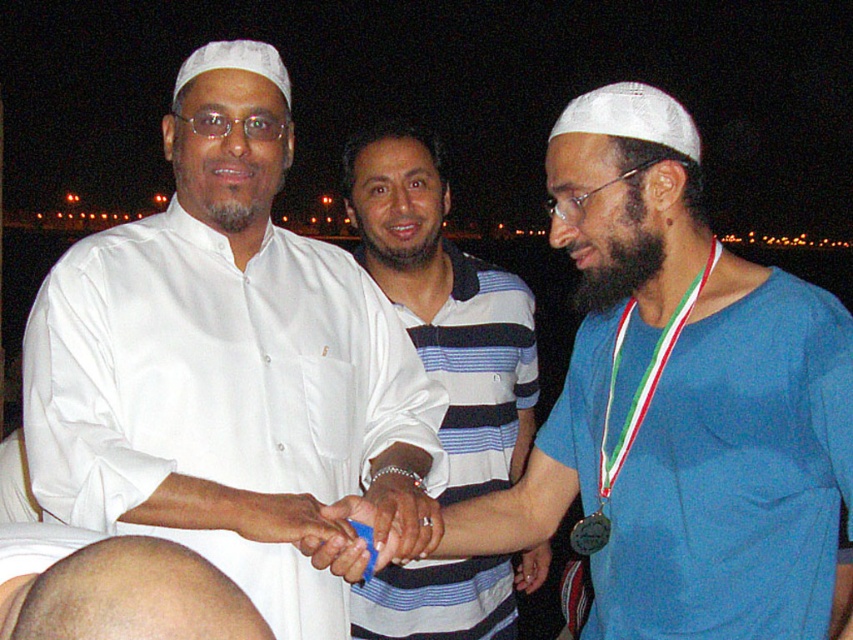
Question: Is blue fabric shirt at center below blue plastic card at center?

Choices:
 (A) yes
 (B) no

Answer: (B)

Question: Among these points, which one is farthest from the camera?

Choices:
 (A) (547, 563)
 (B) (595, 547)
 (C) (323, 445)
 (D) (363, 552)

Answer: (A)

Question: Observing the image, what is the correct spatial positioning of blue fabric shirt at center in reference to gold metallic medal at center?

Choices:
 (A) left
 (B) right

Answer: (B)

Question: Which point is closer to the camera taking this photo?

Choices:
 (A) (689, 595)
 (B) (540, 554)
 (C) (729, 544)
 (D) (376, 499)

Answer: (C)

Question: Does blue fabric shirt at center appear on the right side of blue plastic card at center?

Choices:
 (A) no
 (B) yes

Answer: (B)

Question: Which object appears farthest from the camera in this image?

Choices:
 (A) matte silver ring at center
 (B) bald head at lower left

Answer: (A)